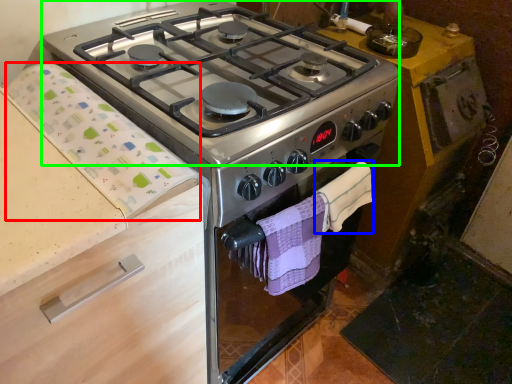
Question: Considering the real-world distances, which object is farthest from blanket (highlighted by a red box)? hand towel (highlighted by a blue box) or gas stove (highlighted by a green box)?

Choices:
 (A) hand towel
 (B) gas stove

Answer: (A)